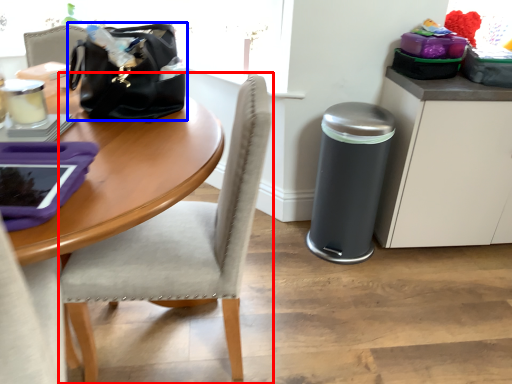
Question: Among these objects, which one is farthest to the camera, chair (highlighted by a red box) or handbag (highlighted by a blue box)?

Choices:
 (A) chair
 (B) handbag

Answer: (B)